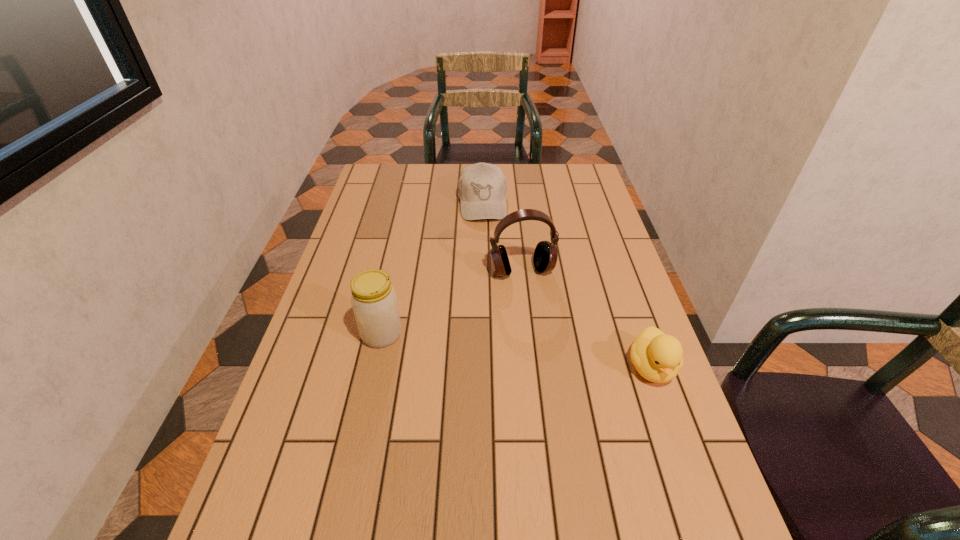
Find the location of a particular element. vacant space on the desktop that is between the jar and the rightmost object and is positioned on the ear pads of the second farthest object is located at coordinates (549, 355).

Find the location of a particular element. free spot on the desktop that is between the leftmost object and the rightmost object and is positioned on the front-facing side of the farthest object is located at coordinates (493, 348).